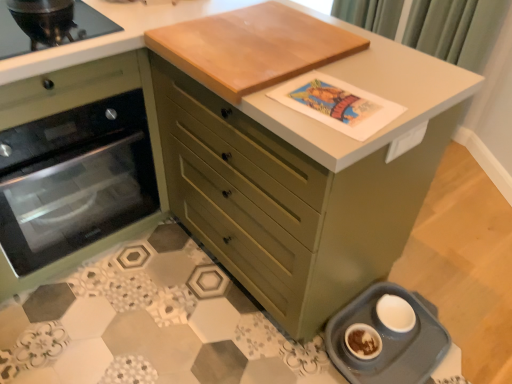
Question: Does matte green chest of drawers at center have a lesser height compared to green fabric curtain at upper right?

Choices:
 (A) no
 (B) yes

Answer: (A)

Question: Is matte green chest of drawers at center not close to green fabric curtain at upper right?

Choices:
 (A) no
 (B) yes

Answer: (B)

Question: From a real-world perspective, is matte green chest of drawers at center on green fabric curtain at upper right?

Choices:
 (A) no
 (B) yes

Answer: (A)

Question: Can you see matte green chest of drawers at center touching green fabric curtain at upper right?

Choices:
 (A) yes
 (B) no

Answer: (B)

Question: Is matte green chest of drawers at center turned away from green fabric curtain at upper right?

Choices:
 (A) yes
 (B) no

Answer: (A)

Question: Is matte green chest of drawers at center facing towards green fabric curtain at upper right?

Choices:
 (A) yes
 (B) no

Answer: (B)

Question: Considering the relative positions of light brown wood cutting board at upper center and matte green chest of drawers at center in the image provided, is light brown wood cutting board at upper center to the right of matte green chest of drawers at center from the viewer's perspective?

Choices:
 (A) yes
 (B) no

Answer: (A)

Question: Does light brown wood cutting board at upper center come behind matte green chest of drawers at center?

Choices:
 (A) no
 (B) yes

Answer: (B)

Question: Is light brown wood cutting board at upper center bigger than matte green chest of drawers at center?

Choices:
 (A) no
 (B) yes

Answer: (A)

Question: From a real-world perspective, is light brown wood cutting board at upper center under matte green chest of drawers at center?

Choices:
 (A) yes
 (B) no

Answer: (B)

Question: Considering the relative sizes of light brown wood cutting board at upper center and matte green chest of drawers at center in the image provided, is light brown wood cutting board at upper center shorter than matte green chest of drawers at center?

Choices:
 (A) no
 (B) yes

Answer: (B)

Question: Is the position of light brown wood cutting board at upper center less distant than that of matte green chest of drawers at center?

Choices:
 (A) no
 (B) yes

Answer: (A)

Question: Does green fabric curtain at upper right have a larger size compared to matte green oven at left?

Choices:
 (A) yes
 (B) no

Answer: (B)